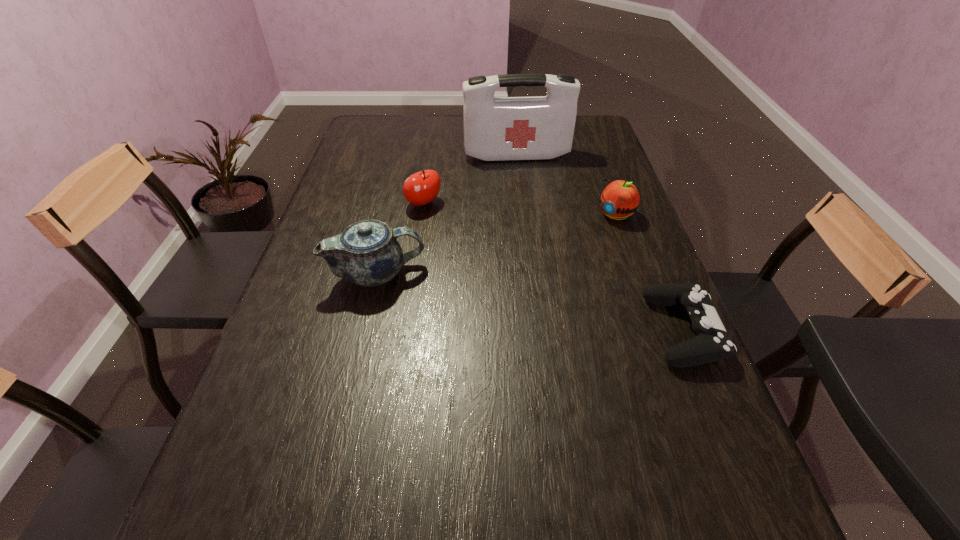
The image size is (960, 540). Find the location of `empty location between the left apple and the right apple`. empty location between the left apple and the right apple is located at coordinates (519, 209).

You are a GUI agent. You are given a task and a screenshot of the screen. Output one action in this format:
    pyautogui.click(x=<x>, y=<y>)
    Task: Click on the free spot between the control and the fourth shortest object
    
    Given the screenshot: What is the action you would take?
    pyautogui.click(x=531, y=302)

This screenshot has width=960, height=540. Find the location of `vacant area that lies between the control and the right apple`. vacant area that lies between the control and the right apple is located at coordinates (649, 272).

Locate an element on the screen. The height and width of the screenshot is (540, 960). the second closest object to the left apple is located at coordinates (538, 127).

At what (x,y) coordinates should I click in order to perform the action: click on object that ranks as the third closest to the right apple. Please return your answer as a coordinate pair (x, y). The image size is (960, 540). Looking at the image, I should click on (421, 188).

What are the coordinates of `vacant space that satisfies the following two spatial constraints: 1. on the front side of the shortest object; 2. on the surface of the right apple` in the screenshot? It's located at (656, 330).

This screenshot has width=960, height=540. Identify the location of vacant space that satisfies the following two spatial constraints: 1. on the front side of the right apple; 2. on the left side of the farthest object. (524, 215).